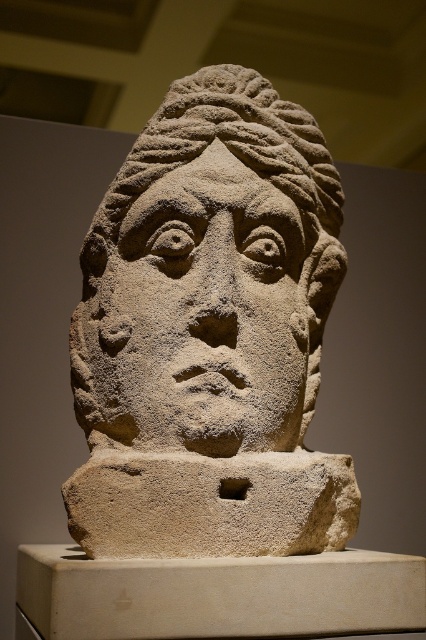
You are an archaeologist examining the sandstone head at center and the stone textured face at center in the museum. Which object is located above the other?

The sandstone head at center is positioned over the stone textured face at center, meaning the sandstone head is above the stone textured face.

You are an archaeologist examining the sandstone head at center and the stone textured face at center in the museum. Which object is taller?

The sandstone head at center is taller than the stone textured face at center.